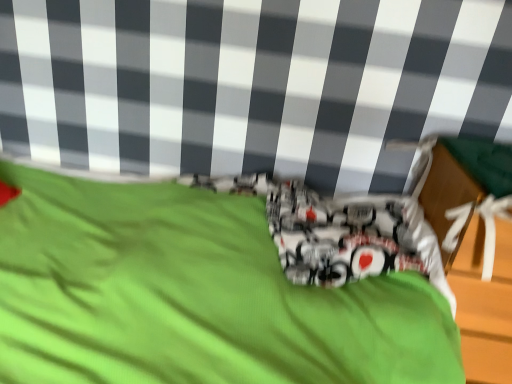
Image resolution: width=512 pixels, height=384 pixels. What do you see at coordinates (146, 291) in the screenshot?
I see `green fabric pillow at center` at bounding box center [146, 291].

This screenshot has width=512, height=384. Find the location of `green fabric pillow at center`. green fabric pillow at center is located at coordinates tap(146, 291).

The width and height of the screenshot is (512, 384). I want to click on green fabric pillow at center, so click(146, 291).